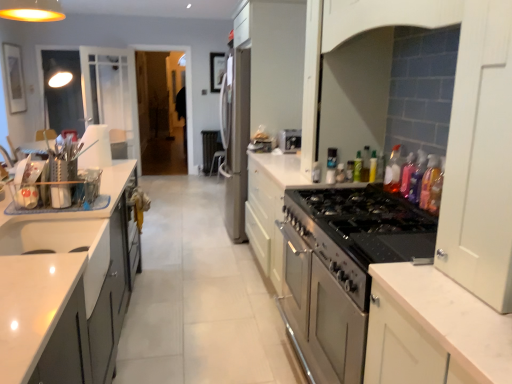
Question: Considering the relative sizes of green glass bottle at upper right, arranged as the 6th bottle when viewed from the front, and translucent plastic bottle at stove top, the 4th bottle from the back, in the image provided, is green glass bottle at upper right, arranged as the 6th bottle when viewed from the front, smaller than translucent plastic bottle at stove top, the 4th bottle from the back,?

Choices:
 (A) yes
 (B) no

Answer: (A)

Question: Are green glass bottle at upper right, arranged as the 6th bottle when viewed from the front, and translucent plastic bottle at stove top, the 4th bottle from the back, making contact?

Choices:
 (A) no
 (B) yes

Answer: (A)

Question: Can you confirm if green glass bottle at upper right, arranged as the 6th bottle when viewed from the front, is thinner than translucent plastic bottle at stove top, which is the 4th bottle in front-to-back order?

Choices:
 (A) no
 (B) yes

Answer: (B)

Question: From the image's perspective, does green glass bottle at upper right, arranged as the 6th bottle when viewed from the front, appear higher than translucent plastic bottle at stove top, the 4th bottle from the back?

Choices:
 (A) yes
 (B) no

Answer: (A)

Question: Is translucent plastic bottle at stove top, the 4th bottle from the back, at the back of green glass bottle at upper right, arranged as the 6th bottle when viewed from the front?

Choices:
 (A) yes
 (B) no

Answer: (B)

Question: Does point (287, 135) appear closer or farther from the camera than point (230, 226)?

Choices:
 (A) farther
 (B) closer

Answer: (B)

Question: From the image's perspective, relative to satin silver refrigerator at center, arranged as the 3th appliance when viewed from the front, is satin silver toaster at center, the second appliance when ordered from bottom to top, above or below?

Choices:
 (A) below
 (B) above

Answer: (A)

Question: Is satin silver toaster at center, positioned as the second appliance in back-to-front order, inside or outside of satin silver refrigerator at center, which is the 1th appliance from top to bottom?

Choices:
 (A) outside
 (B) inside

Answer: (A)

Question: In the image, is satin silver toaster at center, which is counted as the second appliance, starting from the top, on the left side or the right side of satin silver refrigerator at center, positioned as the third appliance in right-to-left order?

Choices:
 (A) left
 (B) right

Answer: (B)

Question: Does point (359, 165) appear closer or farther from the camera than point (413, 193)?

Choices:
 (A) closer
 (B) farther

Answer: (B)

Question: Is green glass bottle at upper right, acting as the second bottle starting from the back, to the left or to the right of translucent plastic bottle at upper right, which appears as the 2th bottle when viewed from the front, in the image?

Choices:
 (A) left
 (B) right

Answer: (A)

Question: Choose the correct answer: Is green glass bottle at upper right, arranged as the 6th bottle when viewed from the front, inside translucent plastic bottle at upper right, which appears as the 2th bottle when viewed from the front, or outside it?

Choices:
 (A) inside
 (B) outside

Answer: (B)

Question: From the image's perspective, is green glass bottle at upper right, acting as the second bottle starting from the back, positioned above or below translucent plastic bottle at upper right, which appears as the 2th bottle when viewed from the front?

Choices:
 (A) below
 (B) above

Answer: (B)

Question: In terms of height, does white glossy sink at lower left look taller or shorter compared to translucent plastic bottle at upper right, which is the sixth bottle in back-to-front order?

Choices:
 (A) short
 (B) tall

Answer: (A)

Question: Looking at their shapes, would you say white glossy sink at lower left is wider or thinner than translucent plastic bottle at upper right, which is the sixth bottle in back-to-front order?

Choices:
 (A) thin
 (B) wide

Answer: (B)